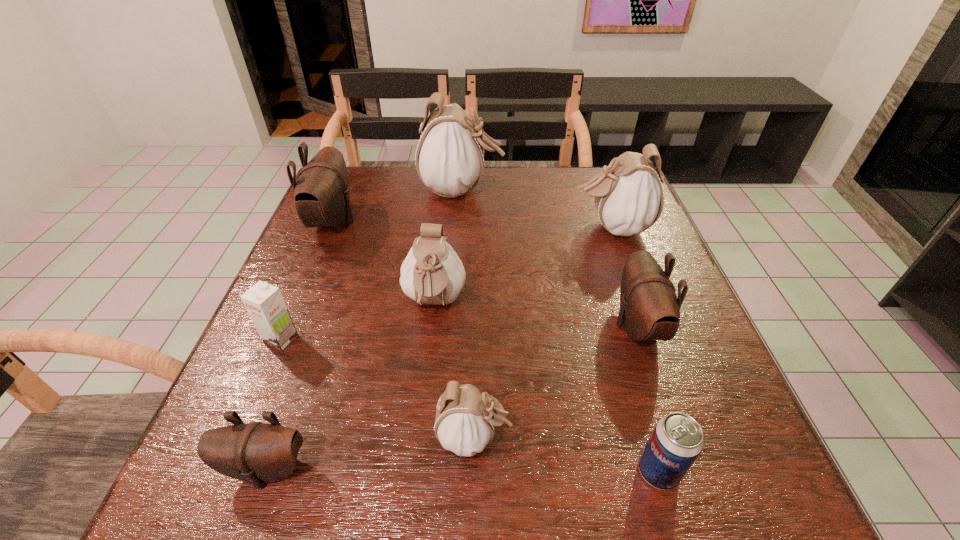
I want to click on the closest white pouch to the beer can, so click(464, 423).

Choose which brown pouch is the nearest neighbor to the rightmost brown pouch. Please provide its 2D coordinates. Your answer should be formatted as a tuple, i.e. [(x, y)], where the tuple contains the x and y coordinates of a point satisfying the conditions above.

[(256, 452)]

This screenshot has width=960, height=540. What are the coordinates of `brown pouch that is the third closest to the brown chocolate milk` in the screenshot? It's located at (649, 309).

Find the location of a particular element. The width and height of the screenshot is (960, 540). vacant region that satisfies the following two spatial constraints: 1. on the front-facing side of the third smallest white pouch; 2. on the front side of the beer can is located at coordinates (700, 471).

This screenshot has width=960, height=540. What are the coordinates of `free space that satisfies the following two spatial constraints: 1. on the front-facing side of the second smallest white pouch; 2. on the right side of the beer can` in the screenshot? It's located at (417, 471).

At what (x,y) coordinates should I click in order to perform the action: click on vacant space that satisfies the following two spatial constraints: 1. on the front-facing side of the third smallest white pouch; 2. with the flap open on the smallest brown pouch. Please return your answer as a coordinate pair (x, y). The image size is (960, 540). Looking at the image, I should click on (699, 469).

I want to click on free space that satisfies the following two spatial constraints: 1. with the flap open on the biggest brown pouch; 2. on the back side of the red beer can, so click(230, 471).